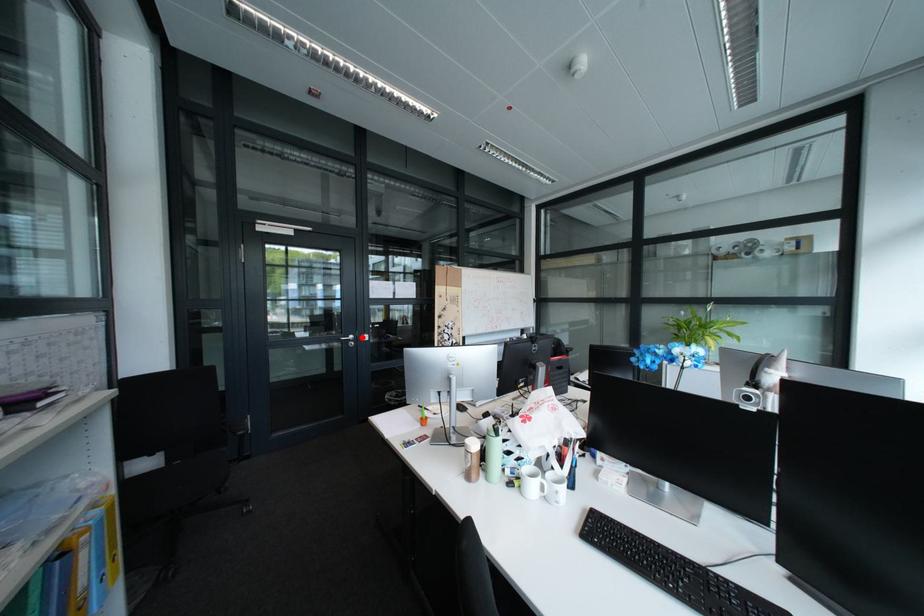
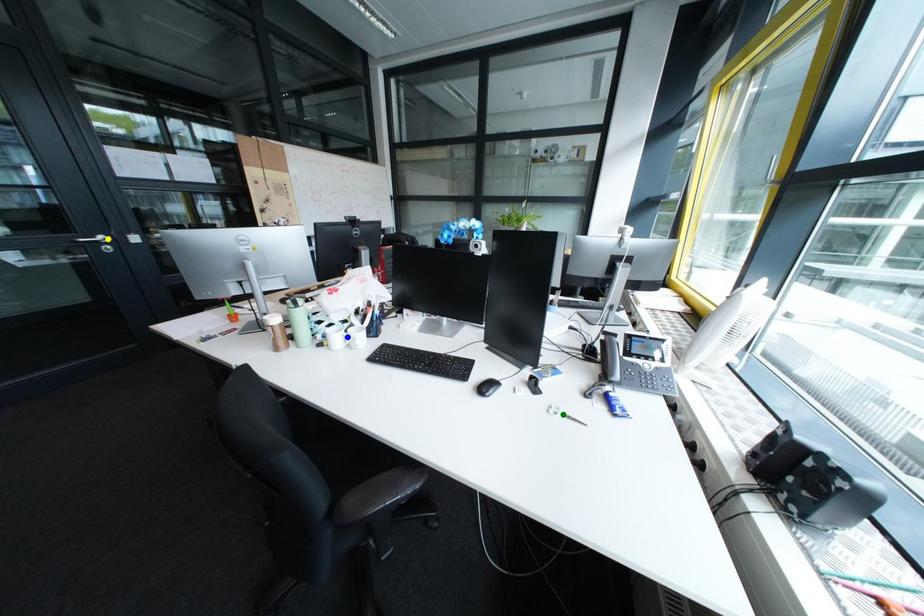
Question: I am providing you with two images of the same scene from different viewpoints. A red point is marked on the first image. You are given multiple points on the second image. Which spot in image 2 lines up with the point in image 1?

Choices:
 (A) blue point
 (B) yellow point
 (C) green point

Answer: (B)